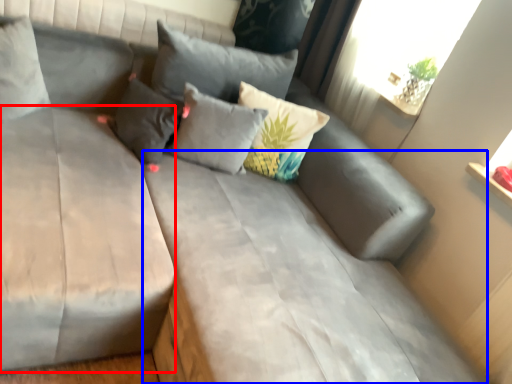
Question: Which of the following is the closest to the observer, mattress (highlighted by a red box) or mattress (highlighted by a blue box)?

Choices:
 (A) mattress
 (B) mattress

Answer: (B)